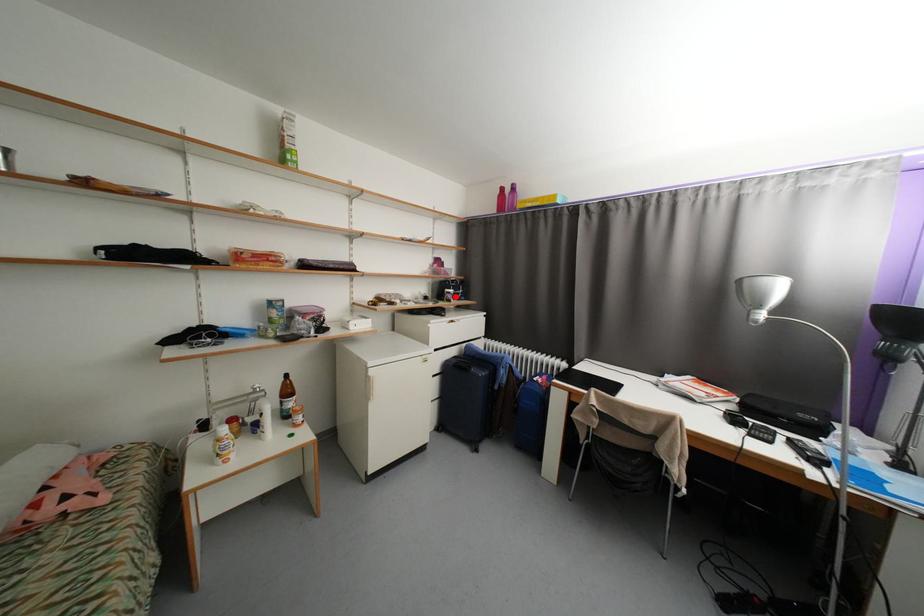
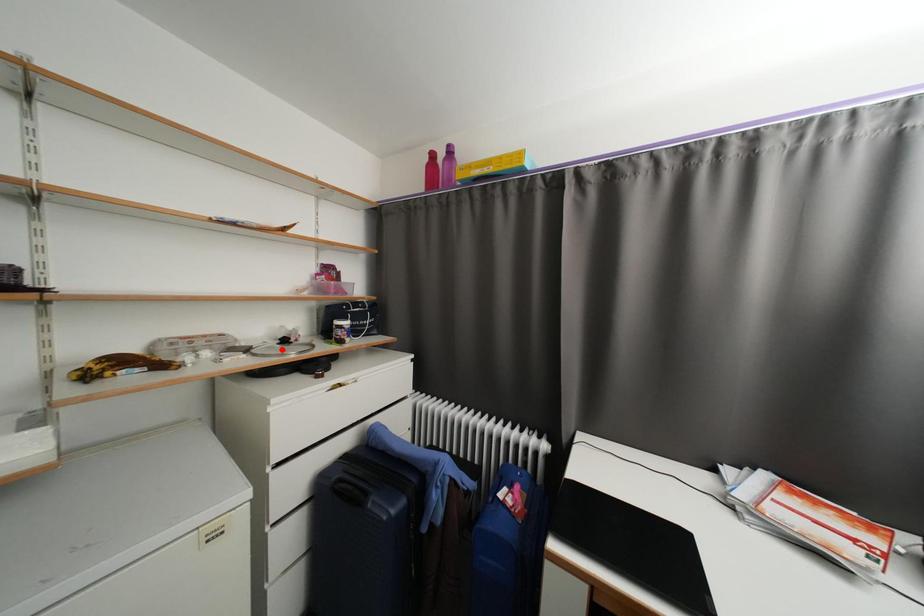
I am providing you with two images of the same scene from different viewpoints. A red point is marked on the first image and another point is marked on the second image. Do the highlighted points in image1 and image2 indicate the same real-world spot?

No